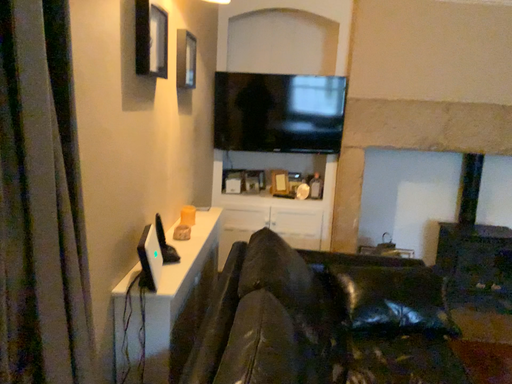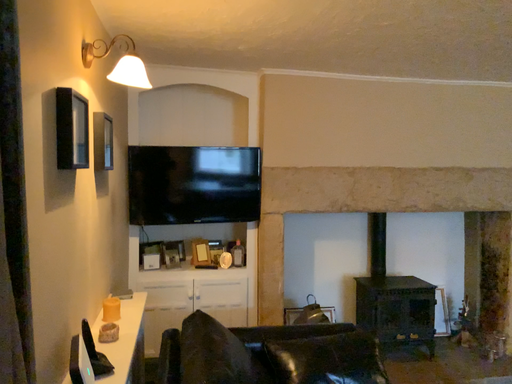
Question: How did the camera likely rotate when shooting the video?

Choices:
 (A) rotated left
 (B) rotated right

Answer: (B)